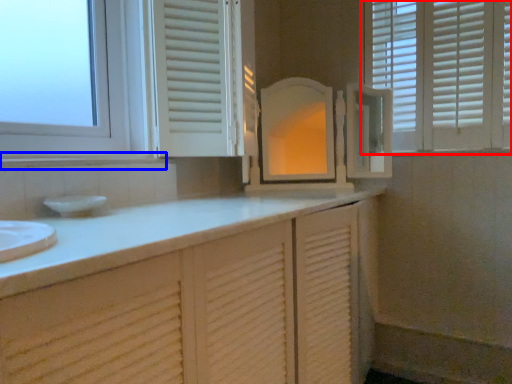
Question: Which object is further to the camera taking this photo, window (highlighted by a red box) or window sill (highlighted by a blue box)?

Choices:
 (A) window
 (B) window sill

Answer: (A)